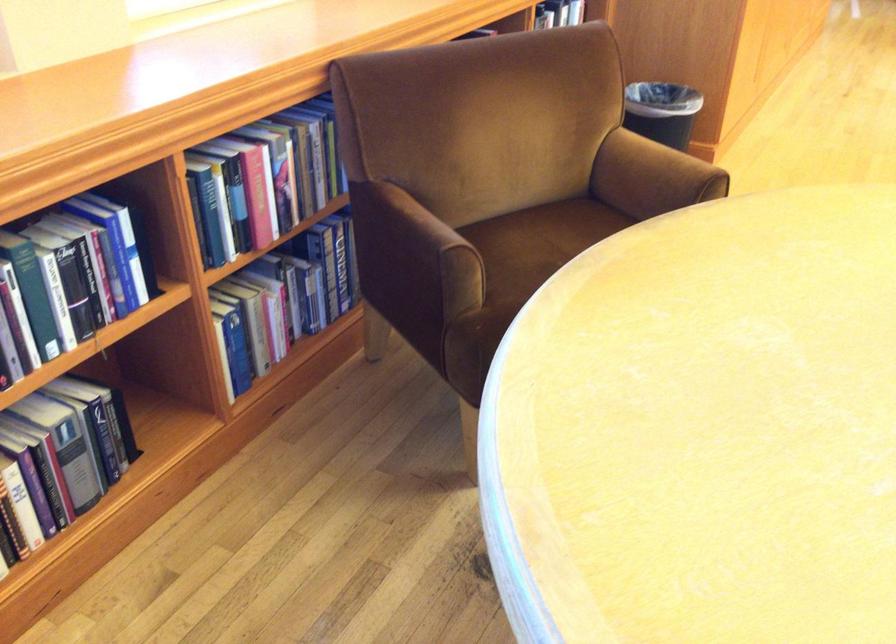
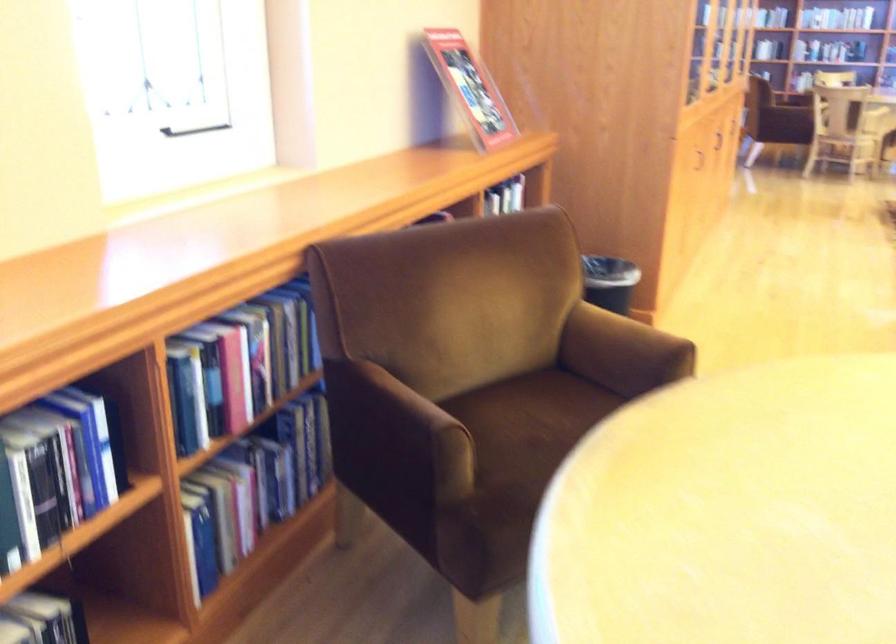
Find the pixel in the second image that matches pixel 134 243 in the first image.

(108, 438)